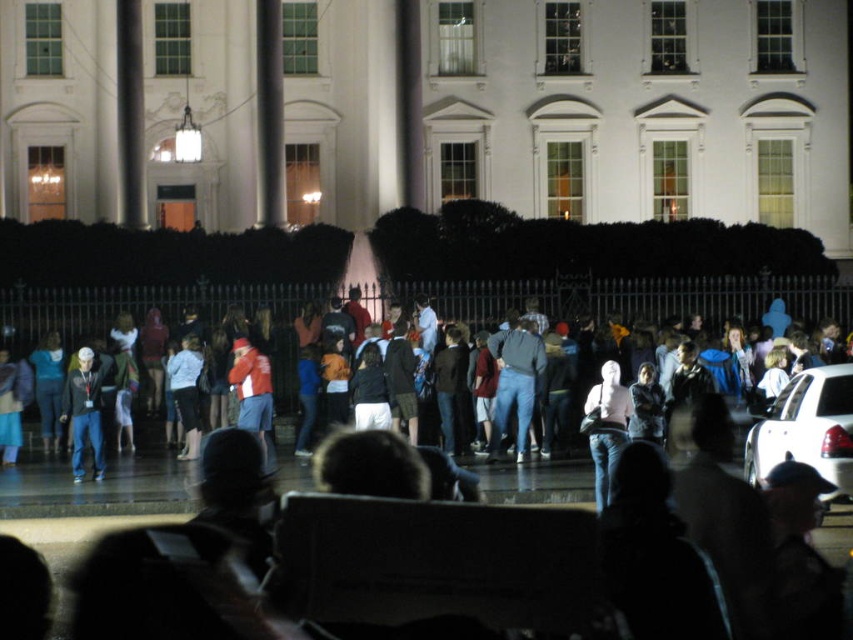
Question: Which of the following is the closest to the observer?

Choices:
 (A) matte black jacket at left
 (B) denim jacket at center

Answer: (A)

Question: Can you confirm if denim jacket at center is positioned to the right of matte black jacket at left?

Choices:
 (A) yes
 (B) no

Answer: (A)

Question: Is denim jacket at center bigger than matte black jacket at left?

Choices:
 (A) yes
 (B) no

Answer: (A)

Question: Which of the following is the closest to the observer?

Choices:
 (A) (140, 340)
 (B) (76, 465)

Answer: (B)

Question: Observing the image, what is the correct spatial positioning of denim jacket at center in reference to matte black jacket at left?

Choices:
 (A) left
 (B) right

Answer: (B)